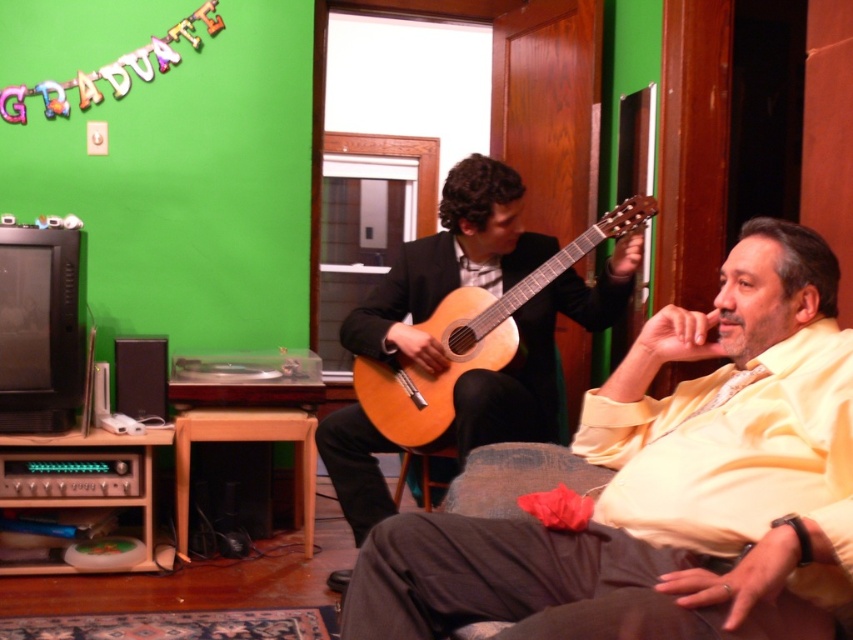
You are standing in the living room and see the point at coordinates (668, 486). According to the scene, where is this point located?

The point at coordinates (668, 486) is on the matte yellow shirt at center.

You are a photographer setting up for a group photo in the living room. You need to position a camera so that both the matte yellow shirt at center and the wooden stool at lower center are visible in the frame. Which object should be closer to the camera to ensure both are in focus?

The matte yellow shirt at center is in front of the wooden stool at lower center, so positioning the camera to focus on the matte yellow shirt at center will keep both objects in focus since it is closer to the camera.

Looking at this image, you are a photographer setting up for a graduation photo. You need to ensure the light brown wood guitar at center and the wooden stool at lower center are visible in the frame. Which object should be placed closer to the camera to ensure both are fully visible?

The light brown wood guitar at center is taller than the wooden stool at lower center. To ensure both are fully visible in the frame, the wooden stool at lower center should be placed closer to the camera so that its height matches the guitar.